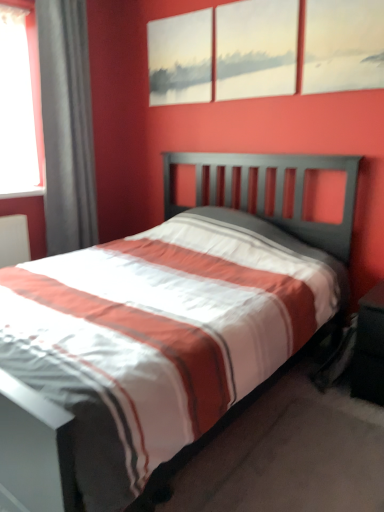
The width and height of the screenshot is (384, 512). What are the coordinates of `free space to the left of black matte nightstand at lower right` in the screenshot? It's located at (309, 392).